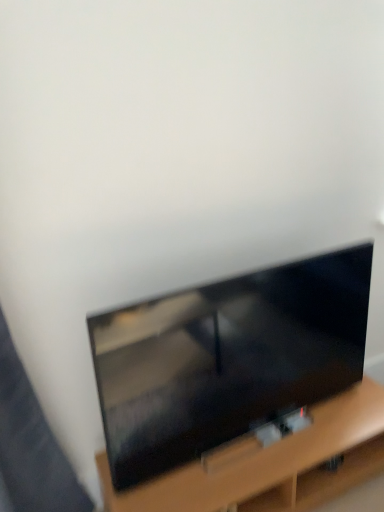
The height and width of the screenshot is (512, 384). I want to click on free location above wooden tv stand at lower center (from a real-world perspective), so click(x=268, y=440).